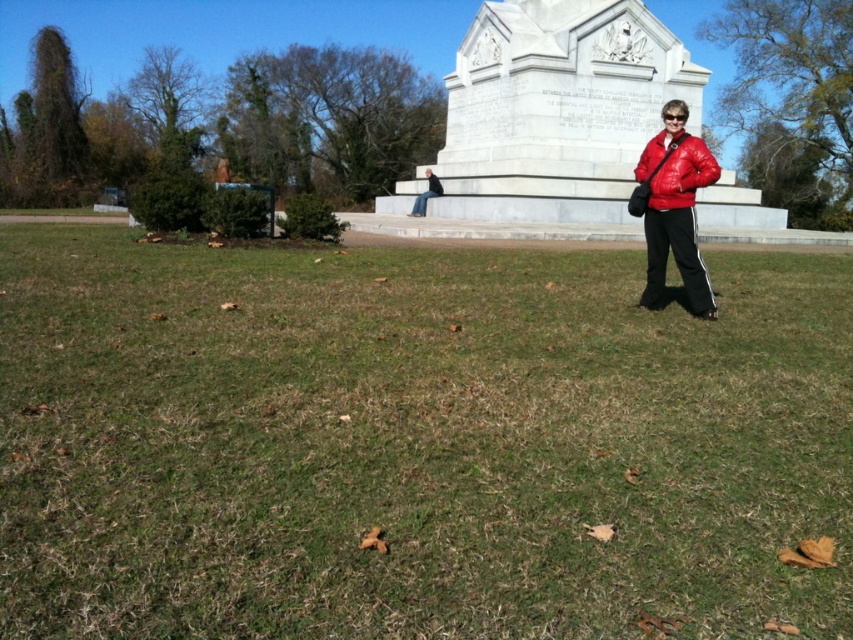
Image resolution: width=853 pixels, height=640 pixels. Find the location of `matte red jacket at right`. matte red jacket at right is located at coordinates (672, 209).

Who is positioned more to the right, matte red jacket at right or matte red jacket at center?

From the viewer's perspective, matte red jacket at center appears more on the right side.

Describe the element at coordinates (672, 209) in the screenshot. The image size is (853, 640). I see `matte red jacket at right` at that location.

Find the location of a particular element. The image size is (853, 640). matte red jacket at right is located at coordinates (672, 209).

Can you confirm if green grass at center is positioned to the left of matte red jacket at center?

Yes, green grass at center is to the left of matte red jacket at center.

How much distance is there between green grass at center and matte red jacket at center?

green grass at center is 3.82 meters from matte red jacket at center.

The width and height of the screenshot is (853, 640). What do you see at coordinates (415, 442) in the screenshot?
I see `green grass at center` at bounding box center [415, 442].

At what (x,y) coordinates should I click in order to perform the action: click on green grass at center. Please return your answer as a coordinate pair (x, y). The width and height of the screenshot is (853, 640). Looking at the image, I should click on (415, 442).

Does point (706, 156) come behind point (431, 177)?

That is False.

Between matte red jacket at center and dark blue jeans at center, which one has more height?

With more height is dark blue jeans at center.

What do you see at coordinates (675, 170) in the screenshot? I see `matte red jacket at center` at bounding box center [675, 170].

Locate an element on the screen. Image resolution: width=853 pixels, height=640 pixels. matte red jacket at center is located at coordinates (675, 170).